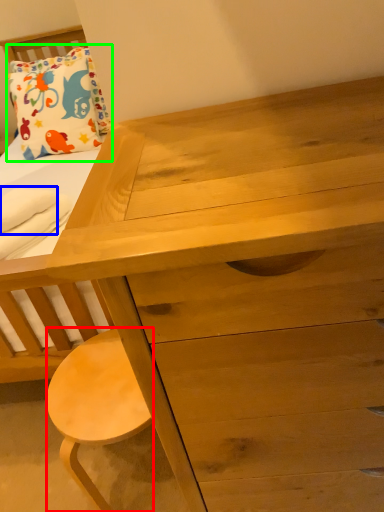
Question: Which object is positioned farthest from stool (highlighted by a red box)? Select from cloth (highlighted by a blue box) and pillow (highlighted by a green box).

Choices:
 (A) cloth
 (B) pillow

Answer: (B)